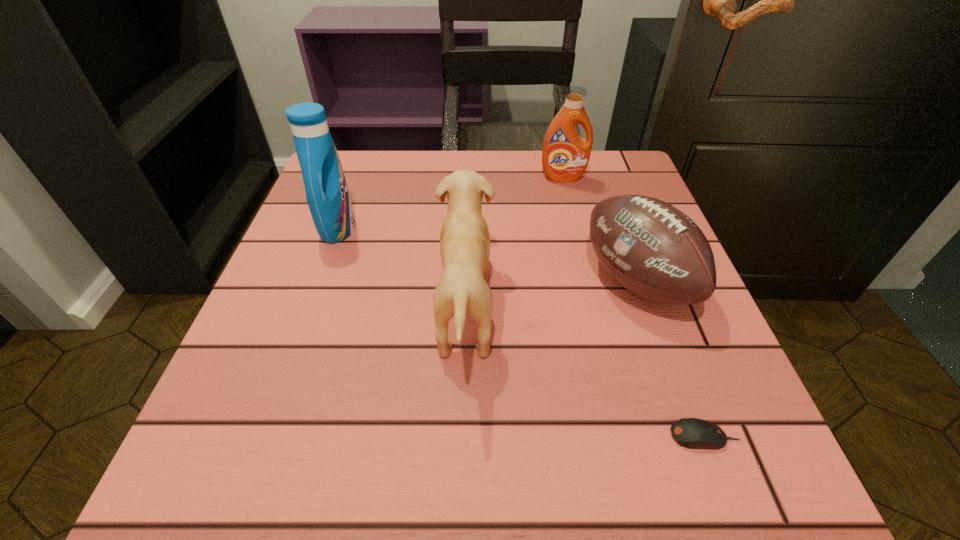
Identify the location of the nearer detergent. (327, 195).

Identify the location of the taller detergent. Image resolution: width=960 pixels, height=540 pixels. (327, 195).

Locate an element on the screen. The width and height of the screenshot is (960, 540). the right detergent is located at coordinates (565, 155).

The image size is (960, 540). I want to click on the farthest object, so click(565, 155).

At what (x,y) coordinates should I click in order to perform the action: click on puppy. Please return your answer as a coordinate pair (x, y). The height and width of the screenshot is (540, 960). Looking at the image, I should click on (464, 238).

Locate an element on the screen. The width and height of the screenshot is (960, 540). the second shortest object is located at coordinates (651, 248).

Where is `computer mouse`? The width and height of the screenshot is (960, 540). computer mouse is located at coordinates (694, 433).

Locate an element on the screen. the nearest object is located at coordinates (694, 433).

The height and width of the screenshot is (540, 960). What are the coordinates of `vacant region located 0.060m on the front-facing side of the nearer detergent` in the screenshot? It's located at (384, 228).

The image size is (960, 540). I want to click on vacant point located on the front-facing side of the shorter detergent, so click(x=581, y=253).